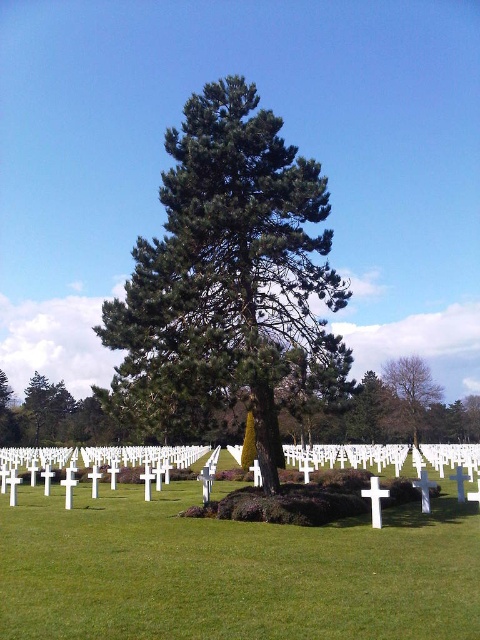
Is green textured tree at center to the left of smooth brown tree at right from the viewer's perspective?

Yes, green textured tree at center is to the left of smooth brown tree at right.

Describe the element at coordinates (227, 272) in the screenshot. I see `green textured tree at center` at that location.

What do you see at coordinates (227, 272) in the screenshot? I see `green textured tree at center` at bounding box center [227, 272].

In order to click on green textured tree at center in this screenshot , I will do `click(227, 272)`.